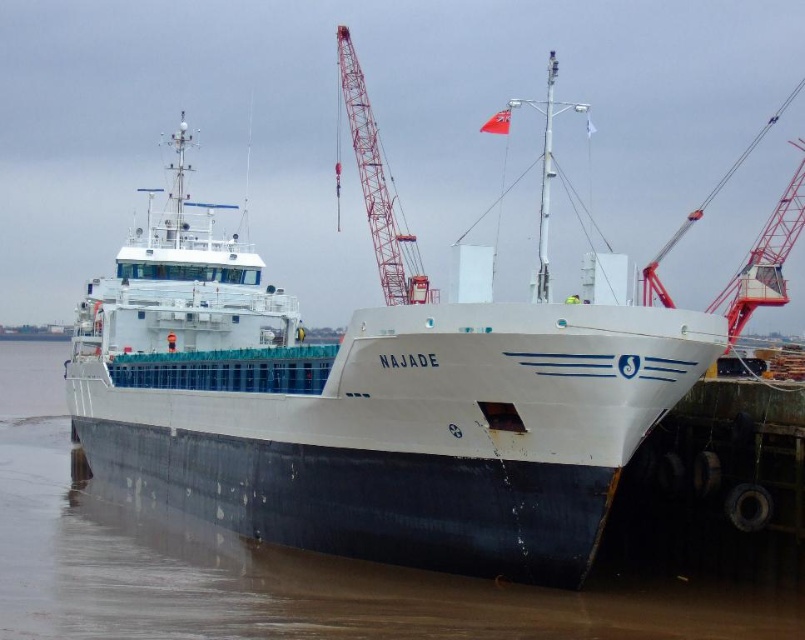
Between white matte ship at center and red metal crane at upper right, which one appears on the left side from the viewer's perspective?

Positioned to the left is white matte ship at center.

This screenshot has height=640, width=805. What do you see at coordinates (374, 408) in the screenshot?
I see `white matte ship at center` at bounding box center [374, 408].

Identify the location of white matte ship at center. (374, 408).

Between white matte ship at center and white matte water at center, which one appears on the right side from the viewer's perspective?

Positioned to the right is white matte ship at center.

Where is `white matte ship at center`? This screenshot has height=640, width=805. white matte ship at center is located at coordinates (374, 408).

Measure the distance between point (428, 426) and camera.

70.83 meters

Identify the location of white matte ship at center. (374, 408).

Which is more to the right, red metallic crane at upper center or metallic red crane at upper right?

From the viewer's perspective, metallic red crane at upper right appears more on the right side.

Based on the photo, does red metallic crane at upper center have a lesser width compared to metallic red crane at upper right?

Indeed, red metallic crane at upper center has a lesser width compared to metallic red crane at upper right.

Is point (380, 157) positioned before point (786, 216)?

No, it is behind (786, 216).

Where is `red metallic crane at upper center`? red metallic crane at upper center is located at coordinates pyautogui.click(x=378, y=188).